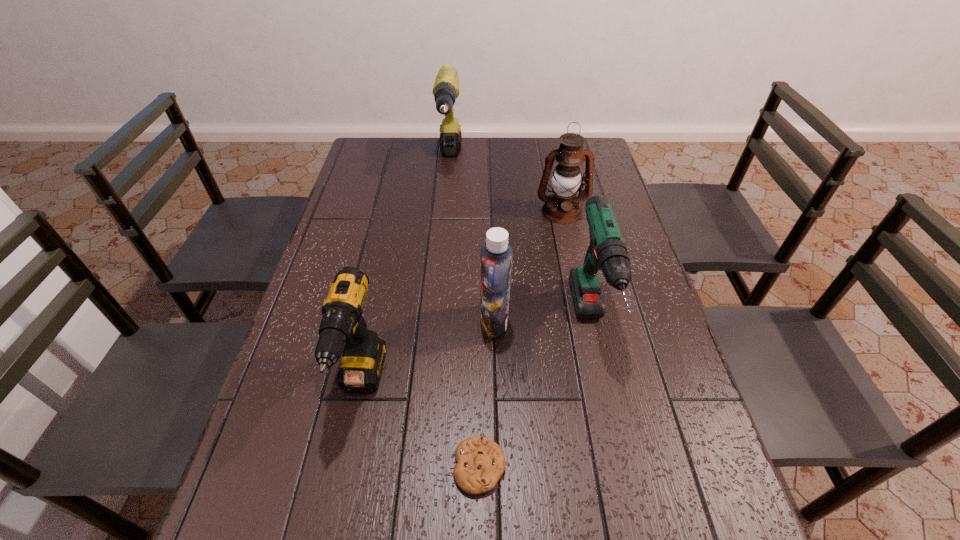
Identify the location of free space between the cookie and the lantern. (520, 339).

Find the location of a particular element. The width and height of the screenshot is (960, 540). free space between the leftmost object and the shampoo is located at coordinates (428, 353).

Image resolution: width=960 pixels, height=540 pixels. What are the coordinates of `vacant region between the leftmost drill and the farthest object` in the screenshot? It's located at (406, 273).

What are the coordinates of `unoccupied area between the second object from left to right and the leftmost drill` in the screenshot? It's located at (406, 273).

Identify which object is the closest to the rightmost drill. Please provide its 2D coordinates. Your answer should be formatted as a tuple, i.e. [(x, y)], where the tuple contains the x and y coordinates of a point satisfying the conditions above.

[(496, 254)]

Choose which object is the nearest neighbor to the second drill from right to left. Please provide its 2D coordinates. Your answer should be formatted as a tuple, i.e. [(x, y)], where the tuple contains the x and y coordinates of a point satisfying the conditions above.

[(562, 206)]

I want to click on drill that stands as the closest to the second farthest object, so click(607, 251).

The height and width of the screenshot is (540, 960). What are the coordinates of `drill that can be found as the second closest to the cookie` in the screenshot? It's located at (607, 251).

Locate an element on the screen. This screenshot has width=960, height=540. vacant space that satisfies the following two spatial constraints: 1. on the front label of the shampoo; 2. on the front side of the nearest object is located at coordinates (498, 467).

This screenshot has height=540, width=960. I want to click on vacant area that satisfies the following two spatial constraints: 1. on the side of the second farthest object, there is a wick adjustment knob; 2. on the front label of the shampoo, so click(x=585, y=322).